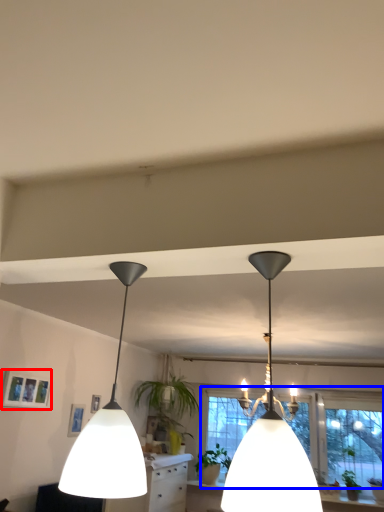
Question: Which of the following is the farthest to the observer, picture frame (highlighted by a red box) or window (highlighted by a blue box)?

Choices:
 (A) picture frame
 (B) window

Answer: (B)